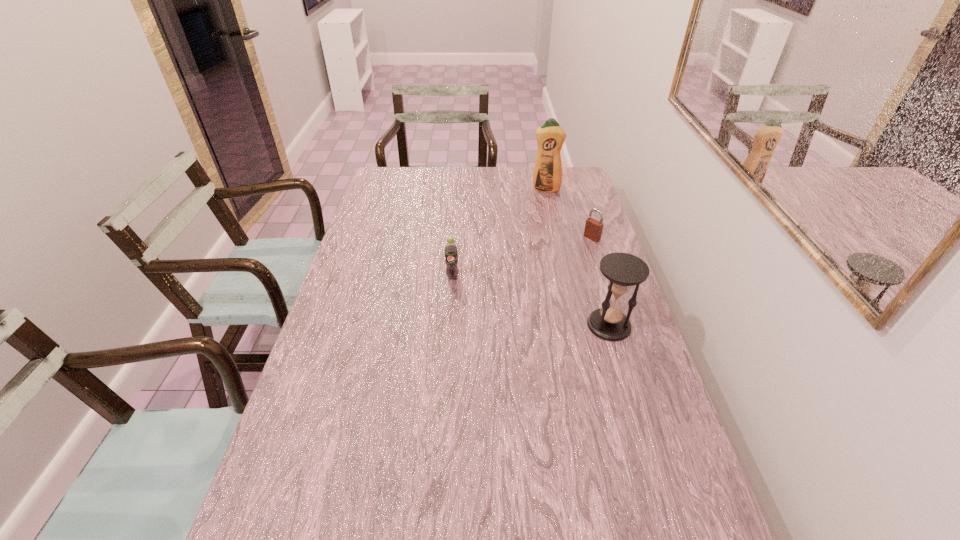
I want to click on free space on the desktop that is between the leftmost object and the nearest object and is positioned on the front-facing side of the third nearest object, so click(509, 295).

You are a GUI agent. You are given a task and a screenshot of the screen. Output one action in this format:
    pyautogui.click(x=<x>, y=<y>)
    Task: Click on the vacant spot on the desktop that is between the third farthest object and the second tallest object and is positioned on the label of the tallest object
    
    Given the screenshot: What is the action you would take?
    pyautogui.click(x=521, y=298)